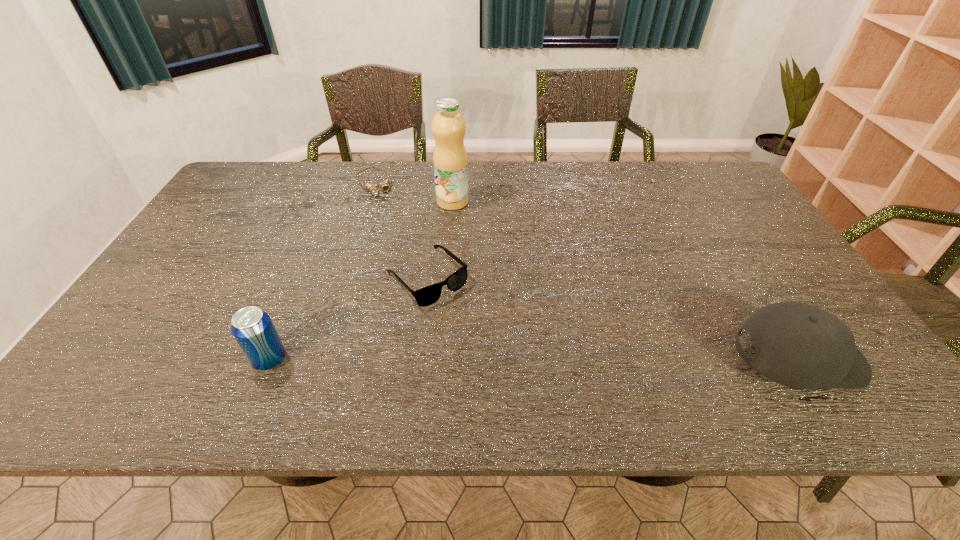
Identify the location of vacant space located on the front-facing side of the second shortest object. This screenshot has width=960, height=540. (473, 326).

Image resolution: width=960 pixels, height=540 pixels. In order to click on free spot located on the front lenses and sides of the shortest object in this screenshot , I will do `click(415, 269)`.

In order to click on free point located 0.390m on the front lenses and sides of the shortest object in this screenshot , I will do `click(418, 274)`.

Identify the location of blank area located on the front lenses and sides of the shortest object. This screenshot has height=540, width=960. (384, 210).

Image resolution: width=960 pixels, height=540 pixels. Find the location of `vacant space located 0.390m on the front label of the fruit juice`. vacant space located 0.390m on the front label of the fruit juice is located at coordinates (529, 288).

Locate an element on the screen. free space located on the front label of the fruit juice is located at coordinates (475, 227).

Where is `free space located 0.390m on the front label of the fruit juice`? free space located 0.390m on the front label of the fruit juice is located at coordinates (529, 288).

Identify the location of goggles located at the far edge. This screenshot has height=540, width=960. (384, 185).

Find the location of a particular element. The height and width of the screenshot is (540, 960). fruit juice that is at the far edge is located at coordinates (450, 161).

Locate an element on the screen. The height and width of the screenshot is (540, 960). beer can at the near edge is located at coordinates (253, 329).